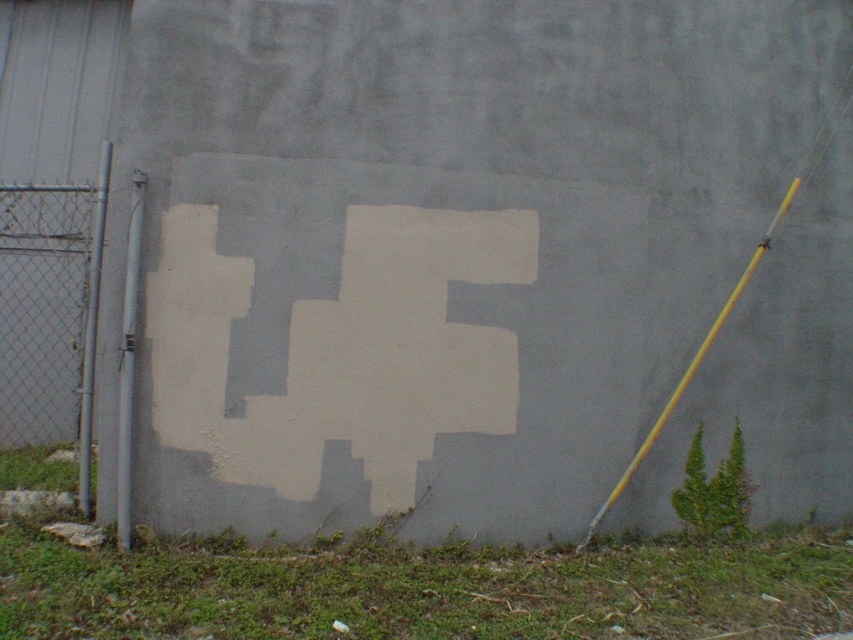
Looking at this image, you are standing in front of the wall described in the scene. You see a white matte cross at center and a brushed metal fence at left. Which object is positioned to the right of the other?

The white matte cross at center is positioned to the right of the brushed metal fence at left.

You are an artist planning to paint a mural on the wall. You want to ensure that the white matte cross at center and the brushed metal fence at left are at least 2 meters apart. Based on the scene description, will this requirement be met?

The white matte cross at center and the brushed metal fence at left are 1.80 meters apart, which is less than the required 2 meters. Therefore, the requirement will not be met.

You are standing in front of the wall described in the scene. You notice a white matte cross at center and a brushed metal fence at left. Which object is nearer to you?

The white matte cross at center is closer to the viewer than the brushed metal fence at left.